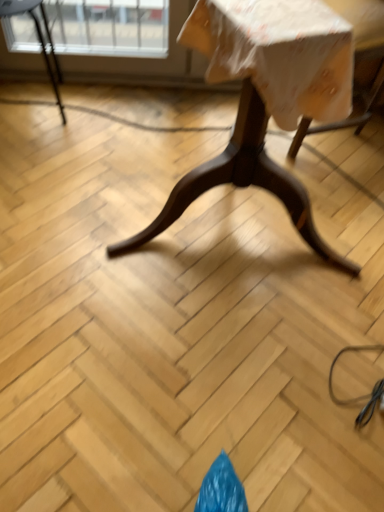
Question: Does metallic black chair at upper left come in front of wooden table at center?

Choices:
 (A) no
 (B) yes

Answer: (A)

Question: Considering the relative sizes of metallic black chair at upper left and wooden table at center in the image provided, is metallic black chair at upper left bigger than wooden table at center?

Choices:
 (A) yes
 (B) no

Answer: (B)

Question: Can we say metallic black chair at upper left lies outside wooden table at center?

Choices:
 (A) yes
 (B) no

Answer: (A)

Question: Does metallic black chair at upper left have a lesser height compared to wooden table at center?

Choices:
 (A) no
 (B) yes

Answer: (B)

Question: Considering the relative sizes of metallic black chair at upper left and wooden table at center in the image provided, is metallic black chair at upper left thinner than wooden table at center?

Choices:
 (A) yes
 (B) no

Answer: (A)

Question: Is metallic black chair at upper left turned away from wooden table at center?

Choices:
 (A) yes
 (B) no

Answer: (B)

Question: From a real-world perspective, is metallic black chair at upper left physically above wooden swivel chair at upper right?

Choices:
 (A) no
 (B) yes

Answer: (A)

Question: Can you confirm if metallic black chair at upper left is wider than wooden swivel chair at upper right?

Choices:
 (A) no
 (B) yes

Answer: (A)

Question: Is metallic black chair at upper left taller than wooden swivel chair at upper right?

Choices:
 (A) yes
 (B) no

Answer: (B)

Question: Does metallic black chair at upper left have a lesser width compared to wooden swivel chair at upper right?

Choices:
 (A) no
 (B) yes

Answer: (B)

Question: Is metallic black chair at upper left smaller than wooden swivel chair at upper right?

Choices:
 (A) yes
 (B) no

Answer: (A)

Question: Is metallic black chair at upper left to the right of wooden swivel chair at upper right from the viewer's perspective?

Choices:
 (A) no
 (B) yes

Answer: (A)

Question: Is the depth of wooden swivel chair at upper right less than that of wooden table at center?

Choices:
 (A) yes
 (B) no

Answer: (B)